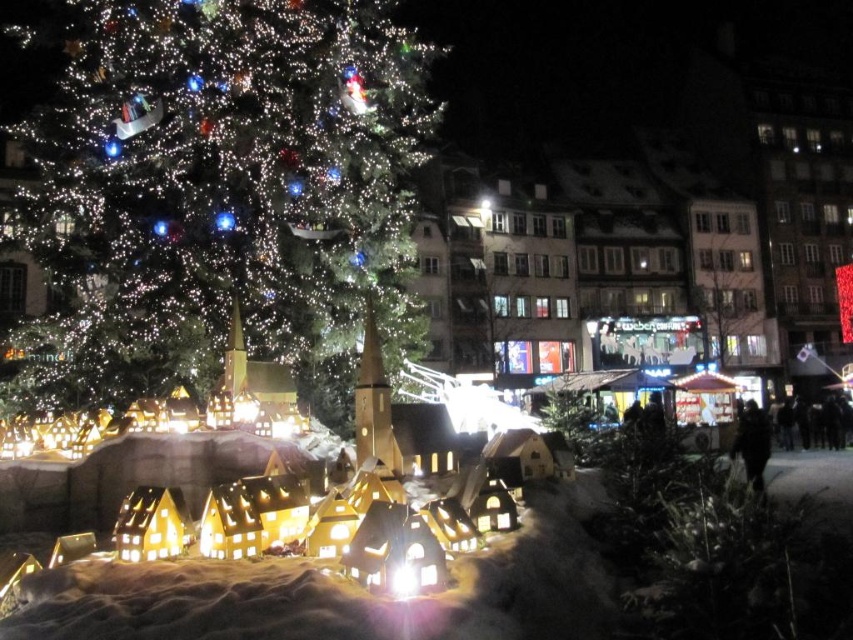
Question: Does illuminated matte green christmas tree at upper left lie in front of black fabric person at lower right?

Choices:
 (A) no
 (B) yes

Answer: (B)

Question: Can you confirm if illuminated matte green christmas tree at upper left is bigger than black fabric person at lower right?

Choices:
 (A) yes
 (B) no

Answer: (A)

Question: From the image, what is the correct spatial relationship of illuminated matte green christmas tree at upper left in relation to black fabric person at lower right?

Choices:
 (A) right
 (B) left

Answer: (B)

Question: Which point appears closest to the camera in this image?

Choices:
 (A) (750, 403)
 (B) (196, 172)

Answer: (B)